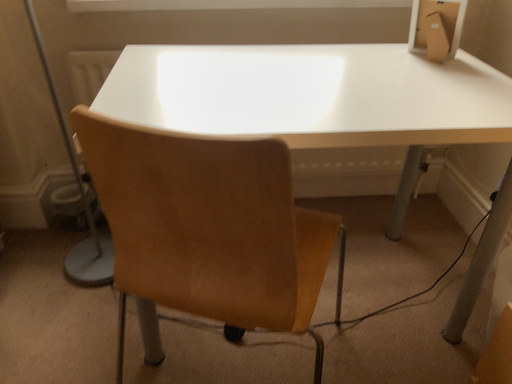
Question: From a real-world perspective, is matte gray table lamp at left beneath white glossy table at center?

Choices:
 (A) yes
 (B) no

Answer: (B)

Question: Considering the relative sizes of matte gray table lamp at left and white glossy table at center in the image provided, is matte gray table lamp at left wider than white glossy table at center?

Choices:
 (A) no
 (B) yes

Answer: (A)

Question: Is matte gray table lamp at left taller than white glossy table at center?

Choices:
 (A) yes
 (B) no

Answer: (A)

Question: Does matte gray table lamp at left have a smaller size compared to white glossy table at center?

Choices:
 (A) yes
 (B) no

Answer: (A)

Question: From the image's perspective, would you say matte gray table lamp at left is shown under white glossy table at center?

Choices:
 (A) yes
 (B) no

Answer: (B)

Question: From the image's perspective, is matte gray table lamp at left over white glossy table at center?

Choices:
 (A) no
 (B) yes

Answer: (B)

Question: From a real-world perspective, is light brown leather chair at center positioned under white glossy table at center based on gravity?

Choices:
 (A) no
 (B) yes

Answer: (A)

Question: From the image's perspective, is light brown leather chair at center below white glossy table at center?

Choices:
 (A) no
 (B) yes

Answer: (B)

Question: Is light brown leather chair at center shorter than white glossy table at center?

Choices:
 (A) no
 (B) yes

Answer: (A)

Question: Is light brown leather chair at center far from white glossy table at center?

Choices:
 (A) no
 (B) yes

Answer: (A)

Question: Could you tell me if light brown leather chair at center is turned towards white glossy table at center?

Choices:
 (A) yes
 (B) no

Answer: (A)

Question: Can you confirm if light brown leather chair at center is smaller than white glossy table at center?

Choices:
 (A) no
 (B) yes

Answer: (B)

Question: Is white glossy table at center looking in the opposite direction of light brown leather chair at center?

Choices:
 (A) no
 (B) yes

Answer: (B)